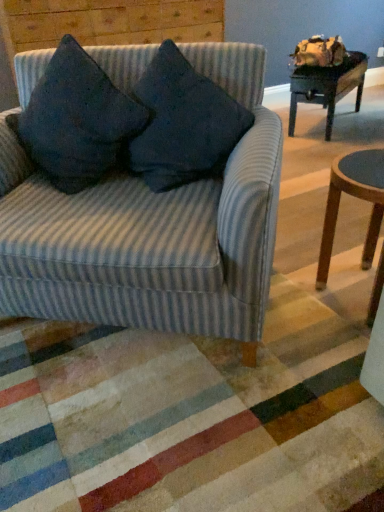
Question: Is dark blue fabric pillow at upper left, positioned as the second throw pillow in right-to-left order, wider than dark blue fabric cushion at upper left?

Choices:
 (A) yes
 (B) no

Answer: (B)

Question: Considering the relative sizes of dark blue fabric pillow at upper left, positioned as the second throw pillow in right-to-left order, and dark blue fabric cushion at upper left in the image provided, is dark blue fabric pillow at upper left, positioned as the second throw pillow in right-to-left order, shorter than dark blue fabric cushion at upper left?

Choices:
 (A) no
 (B) yes

Answer: (B)

Question: From the image's perspective, does dark blue fabric pillow at upper left, positioned as the second throw pillow in right-to-left order, appear lower than dark blue fabric cushion at upper left?

Choices:
 (A) yes
 (B) no

Answer: (A)

Question: Does dark blue fabric pillow at upper left, which appears as the first throw pillow when viewed from the left, turn towards dark blue fabric cushion at upper left?

Choices:
 (A) yes
 (B) no

Answer: (B)

Question: From a real-world perspective, is dark blue fabric pillow at upper left, which appears as the first throw pillow when viewed from the left, positioned under dark blue fabric cushion at upper left based on gravity?

Choices:
 (A) yes
 (B) no

Answer: (A)

Question: In terms of width, does dark blue fabric pillow at upper left, positioned as the second throw pillow in right-to-left order, look wider or thinner when compared to wooden round stool at lower right?

Choices:
 (A) wide
 (B) thin

Answer: (B)

Question: Is point (64, 53) closer or farther from the camera than point (379, 158)?

Choices:
 (A) closer
 (B) farther

Answer: (B)

Question: Looking at the image, does dark blue fabric pillow at upper left, positioned as the second throw pillow in right-to-left order, seem bigger or smaller compared to wooden round stool at lower right?

Choices:
 (A) small
 (B) big

Answer: (B)

Question: From the image's perspective, is dark blue fabric pillow at upper left, positioned as the second throw pillow in right-to-left order, located above or below wooden round stool at lower right?

Choices:
 (A) above
 (B) below

Answer: (A)

Question: Visually, is wooden table at upper right positioned to the left or to the right of wooden round stool at lower right?

Choices:
 (A) right
 (B) left

Answer: (A)

Question: Considering the positions of point (342, 92) and point (367, 152), is point (342, 92) closer or farther from the camera than point (367, 152)?

Choices:
 (A) closer
 (B) farther

Answer: (B)

Question: In terms of size, does wooden table at upper right appear bigger or smaller than wooden round stool at lower right?

Choices:
 (A) small
 (B) big

Answer: (B)

Question: Is wooden table at upper right taller or shorter than wooden round stool at lower right?

Choices:
 (A) tall
 (B) short

Answer: (B)

Question: Relative to dark blue fabric cushion at upper left, is dark blue fabric pillow at upper left, which appears as the first throw pillow when viewed from the left, in front or behind?

Choices:
 (A) behind
 (B) front

Answer: (B)

Question: In terms of width, does dark blue fabric pillow at upper left, which appears as the first throw pillow when viewed from the left, look wider or thinner when compared to dark blue fabric cushion at upper left?

Choices:
 (A) wide
 (B) thin

Answer: (B)